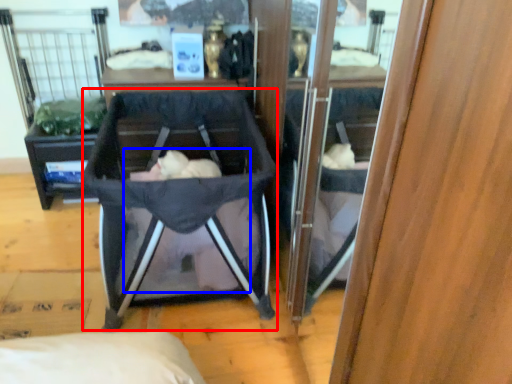
Question: Which object is closer to the camera taking this photo, baby carriage (highlighted by a red box) or baby (highlighted by a blue box)?

Choices:
 (A) baby carriage
 (B) baby

Answer: (A)